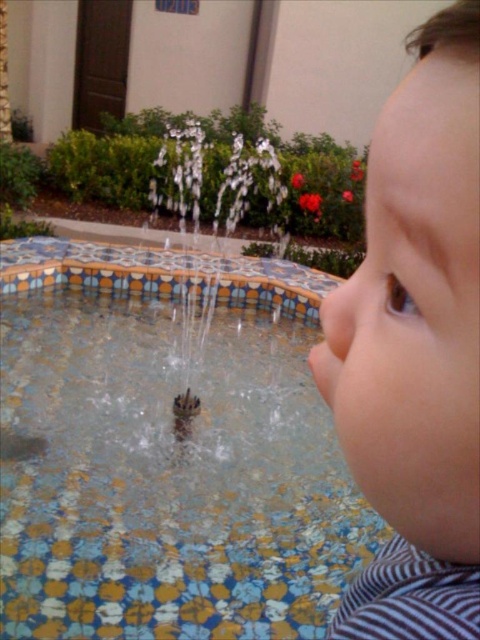
You are holding a camera and want to take a photo of the multicolored mosaic pool at center. If you are standing 4.23 feet away from the pool, is the distance sufficient to capture the entire pool in the frame?

The multicolored mosaic pool at center and camera are 4.23 feet apart from each other. The distance is sufficient to capture the entire pool in the frame as you are standing exactly at that distance.

You are standing at the center of the image. Which direction should you move to get closer to the multicolored mosaic pool at center?

The multicolored mosaic pool at center is already at the center of the image, so you don not need to move in any direction to get closer.